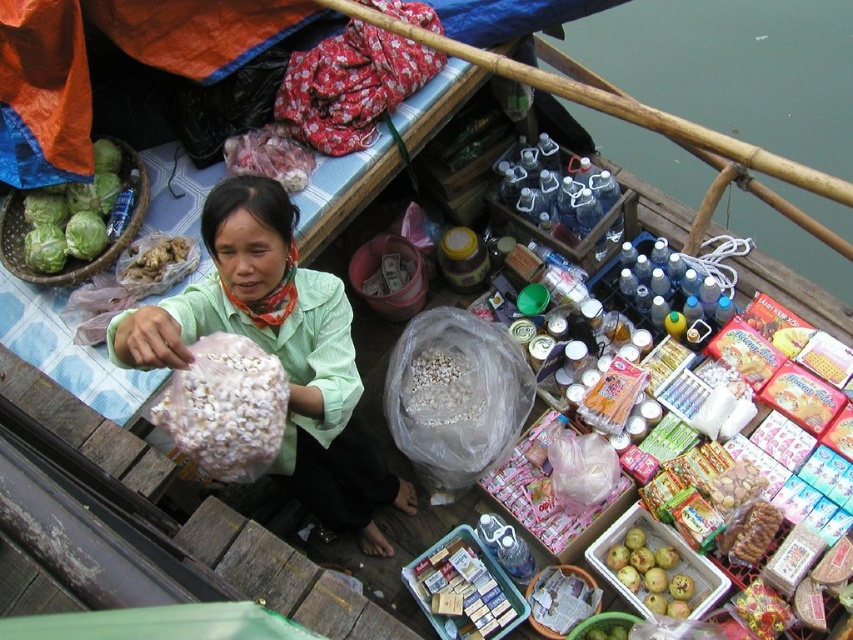
Which of these two, green leafy cabbage at left or green matte apples at lower right, stands shorter?

With less height is green matte apples at lower right.

Does green leafy cabbage at left lie in front of green matte apples at lower right?

Yes, it is.

Does point (120, 148) lie behind point (625, 554)?

That is True.

Where is `green leafy cabbage at left`? green leafy cabbage at left is located at coordinates (73, 216).

Between point (306, 269) and point (233, 397), which one is positioned behind?

Point (306, 269)

Is matte green blouse at center thinner than white matte dried beans at center?

In fact, matte green blouse at center might be wider than white matte dried beans at center.

The image size is (853, 640). What do you see at coordinates (277, 352) in the screenshot?
I see `matte green blouse at center` at bounding box center [277, 352].

Image resolution: width=853 pixels, height=640 pixels. Identify the location of matte green blouse at center. (277, 352).

Does matte green blouse at center have a greater width compared to green leafy cabbage at left?

Correct, the width of matte green blouse at center exceeds that of green leafy cabbage at left.

Between point (282, 234) and point (73, 216), which one is positioned behind?

The point (73, 216) is behind.

Where is `matte green blouse at center`? This screenshot has width=853, height=640. matte green blouse at center is located at coordinates (277, 352).